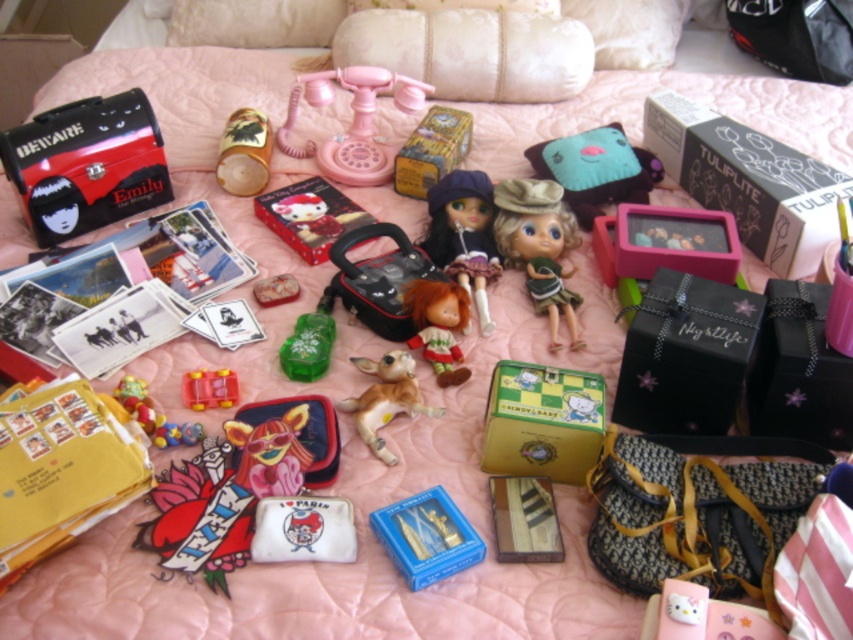
Question: Is matte purple doll at center to the left of wooden toy at center from the viewer's perspective?

Choices:
 (A) no
 (B) yes

Answer: (A)

Question: Which point is closer to the camera?

Choices:
 (A) matte plastic doll at center
 (B) satin-like pink purse at center
 (C) matte green fabric doll at center
 (D) brown matte toy dog at center

Answer: (B)

Question: Which object appears closest to the camera in this image?

Choices:
 (A) green matte toy at center
 (B) matte black toy chest at upper left
 (C) matte purple doll at center

Answer: (C)

Question: In this image, where is creamy satin pillow at upper center located relative to matte plastic doll at center?

Choices:
 (A) above
 (B) below

Answer: (A)

Question: Can you confirm if velvet plush toy at center is wider than blue plastic toy at center?

Choices:
 (A) yes
 (B) no

Answer: (A)

Question: Which object appears closest to the camera in this image?

Choices:
 (A) blue plastic toy at center
 (B) matte plastic doll at center

Answer: (A)